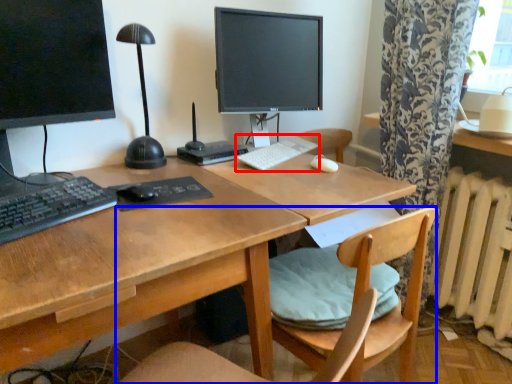
Question: Which object is further to the camera taking this photo, keyboard (highlighted by a red box) or chair (highlighted by a blue box)?

Choices:
 (A) keyboard
 (B) chair

Answer: (A)